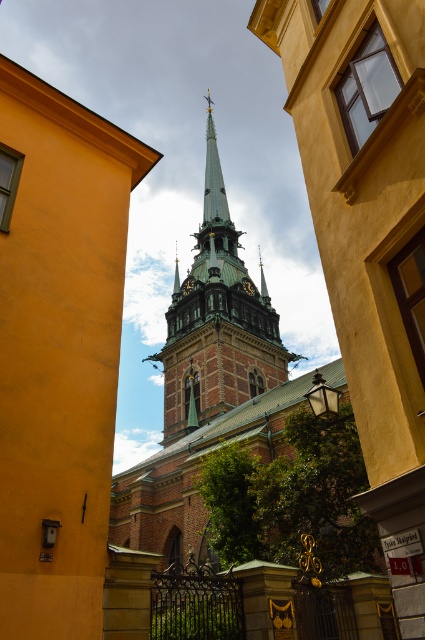
Question: Which of the following is the farthest from the observer?

Choices:
 (A) (223, 342)
 (B) (260, 262)
 (C) (175, 260)
 (D) (224, 336)

Answer: (B)

Question: Can you confirm if green metallic spire at center is bigger than gold metallic clock at center?

Choices:
 (A) yes
 (B) no

Answer: (A)

Question: Considering the relative positions of green copper spire at center and gold metallic clock at center in the image provided, where is green copper spire at center located with respect to gold metallic clock at center?

Choices:
 (A) right
 (B) left

Answer: (B)

Question: Can you confirm if green metallic spire at center is smaller than gold metallic clock at center?

Choices:
 (A) no
 (B) yes

Answer: (A)

Question: Which point is closer to the camera taking this photo?

Choices:
 (A) (251, 291)
 (B) (257, 244)
 (C) (238, 396)
 (D) (223, 291)

Answer: (C)

Question: Based on their relative distances, which object is farther from the brown stone tower at center?

Choices:
 (A) gold metallic clock at center
 (B) green metallic spire at center

Answer: (B)